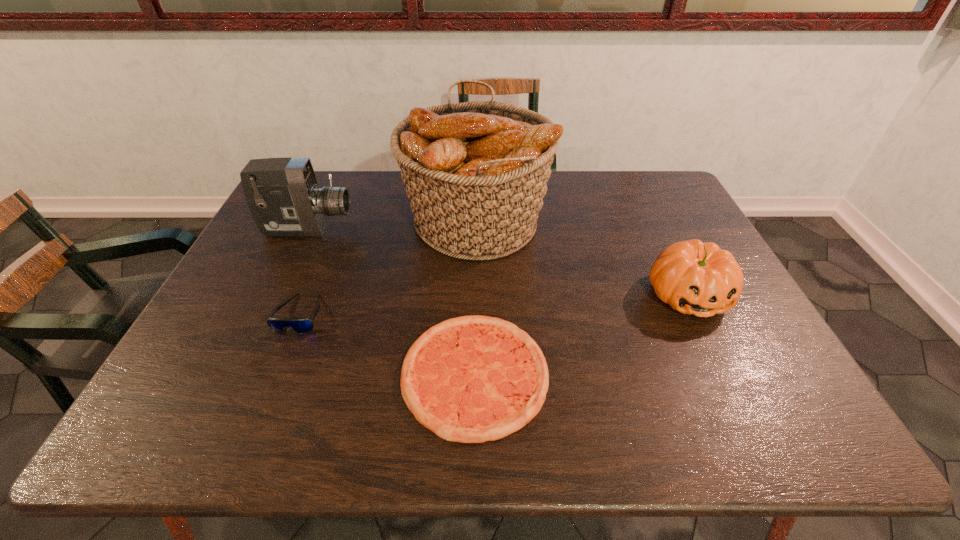
What are the coordinates of `free space located on the left of the shortest object` in the screenshot? It's located at (289, 374).

Find the location of a particular element. The image size is (960, 540). object that is at the far edge is located at coordinates (476, 173).

Locate an element on the screen. object that is at the near edge is located at coordinates (470, 379).

Find the location of a particular element. This screenshot has width=960, height=540. object positioned at the left edge is located at coordinates (283, 196).

At what (x,y) coordinates should I click in order to perform the action: click on object at the right edge. Please return your answer as a coordinate pair (x, y). Looking at the image, I should click on (693, 277).

Locate an element on the screen. vacant space at the near edge of the desktop is located at coordinates (403, 441).

I want to click on vacant space at the right edge of the desktop, so click(x=764, y=356).

Where is `vacant space at the far left corner of the desktop`? vacant space at the far left corner of the desktop is located at coordinates (324, 176).

The width and height of the screenshot is (960, 540). What are the coordinates of `vacant position at the near left corner of the desktop` in the screenshot? It's located at (200, 414).

The width and height of the screenshot is (960, 540). I want to click on free location at the far right corner of the desktop, so pos(661,172).